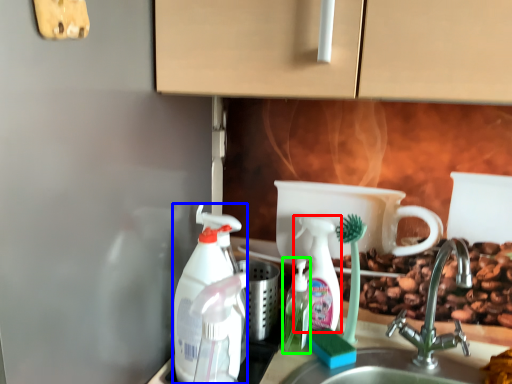
Question: Which object is positioned farthest from cleaning product (highlighted by a red box)? Select from cleaning product (highlighted by a blue box) and bottle (highlighted by a green box).

Choices:
 (A) cleaning product
 (B) bottle

Answer: (A)